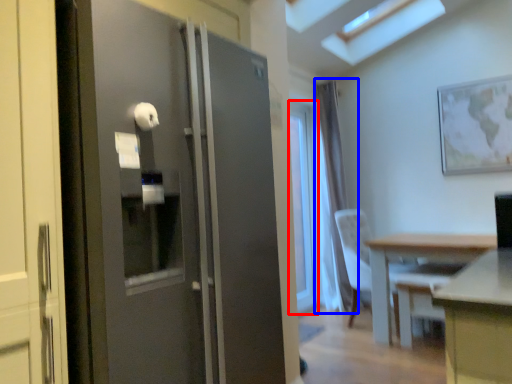
Question: Which object is closer to the camera taking this photo, window (highlighted by a red box) or curtain (highlighted by a blue box)?

Choices:
 (A) window
 (B) curtain

Answer: (A)